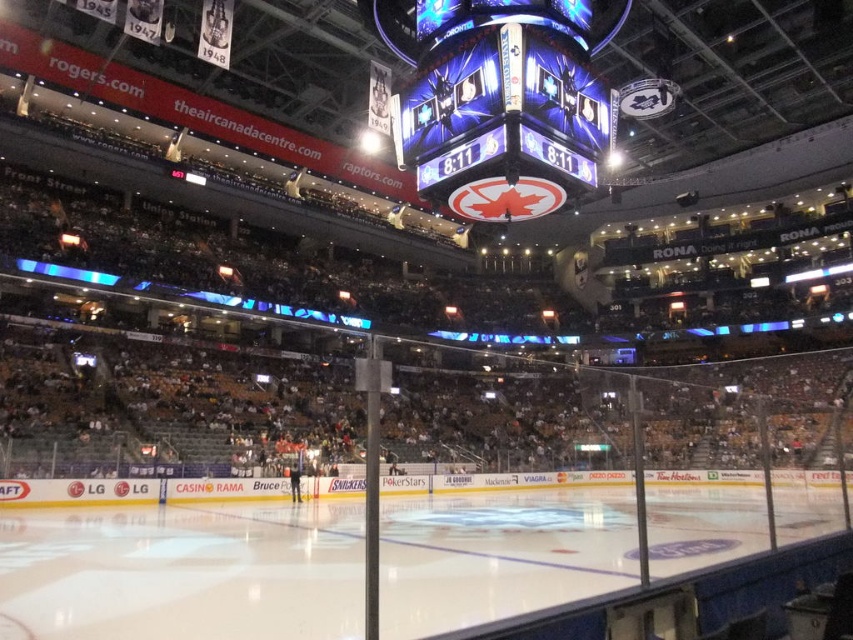
Question: Which object appears closest to the camera in this image?

Choices:
 (A) white smooth ice at center
 (B) shiny digital display at center

Answer: (A)

Question: From the image, what is the correct spatial relationship of white smooth ice at center in relation to shiny digital display at center?

Choices:
 (A) right
 (B) left

Answer: (A)

Question: Which of the following is the farthest from the observer?

Choices:
 (A) (451, 72)
 (B) (35, 584)

Answer: (A)

Question: Can you confirm if white smooth ice at center is bigger than shiny digital display at center?

Choices:
 (A) no
 (B) yes

Answer: (B)

Question: Is white smooth ice at center closer to camera compared to shiny digital display at center?

Choices:
 (A) yes
 (B) no

Answer: (A)